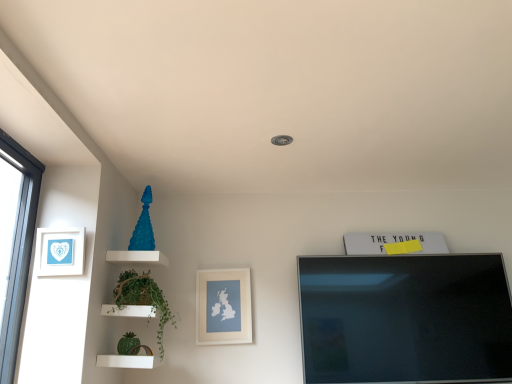
Question: Considering the relative sizes of white paper at left, the 2th picture frame in the right-to-left sequence, and matte white picture frame at center, which appears as the second picture frame when viewed from the left, in the image provided, is white paper at left, the 2th picture frame in the right-to-left sequence, thinner than matte white picture frame at center, which appears as the second picture frame when viewed from the left,?

Choices:
 (A) yes
 (B) no

Answer: (B)

Question: Is matte white picture frame at center, which appears as the second picture frame when viewed from the left, located within white paper at left, the 2th picture frame in the right-to-left sequence?

Choices:
 (A) yes
 (B) no

Answer: (B)

Question: From a real-world perspective, is white paper at left, which is the first picture frame from front to back, located higher than matte white picture frame at center, which appears as the second picture frame when viewed from the left?

Choices:
 (A) no
 (B) yes

Answer: (B)

Question: Can you confirm if white paper at left, which ranks as the second picture frame in bottom-to-top order, is bigger than matte white picture frame at center, which is the first picture frame in bottom-to-top order?

Choices:
 (A) no
 (B) yes

Answer: (A)

Question: Is the position of white paper at left, which is the first picture frame in top-to-bottom order, less distant than that of matte white picture frame at center, which appears as the second picture frame when viewed from the left?

Choices:
 (A) yes
 (B) no

Answer: (A)

Question: Considering the relative sizes of white paper at left, which is the first picture frame from front to back, and matte white picture frame at center, arranged as the first picture frame when viewed from the right, in the image provided, is white paper at left, which is the first picture frame from front to back, smaller than matte white picture frame at center, arranged as the first picture frame when viewed from the right,?

Choices:
 (A) yes
 (B) no

Answer: (A)

Question: Is white paper at left, which is the first picture frame in top-to-bottom order, inside matte white picture frame at center, the 2th picture frame from the front?

Choices:
 (A) no
 (B) yes

Answer: (A)

Question: Is matte white picture frame at center, which is the first picture frame in bottom-to-top order, oriented away from white paper at left, which is the first picture frame from front to back?

Choices:
 (A) yes
 (B) no

Answer: (B)

Question: Can you confirm if matte white picture frame at center, arranged as the first picture frame when viewed from the right, is positioned to the left of white paper at left, the 2th picture frame in the right-to-left sequence?

Choices:
 (A) no
 (B) yes

Answer: (A)

Question: Does matte white picture frame at center, the 1th picture frame in the back-to-front sequence, have a greater height compared to white paper at left, which is the first picture frame in top-to-bottom order?

Choices:
 (A) yes
 (B) no

Answer: (A)

Question: Could you tell me if matte white picture frame at center, the 2th picture frame from the front, is facing white paper at left, which is the first picture frame in top-to-bottom order?

Choices:
 (A) yes
 (B) no

Answer: (B)

Question: From the image's perspective, is matte white picture frame at center, the 2th picture frame from the front, under white paper at left, which is the first picture frame in top-to-bottom order?

Choices:
 (A) yes
 (B) no

Answer: (A)

Question: Is matte white picture frame at center, which is the first picture frame in bottom-to-top order, thinner than green leafy plant at left?

Choices:
 (A) no
 (B) yes

Answer: (B)